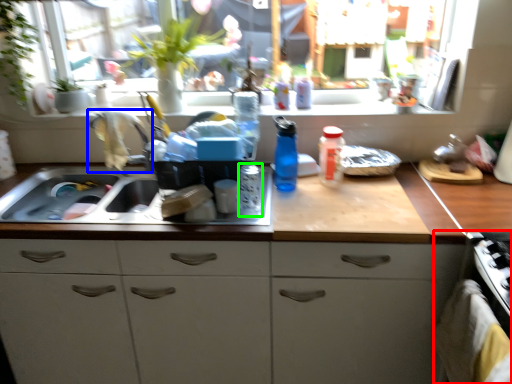
Question: Which object is the closest to the oven (highlighted by a red box)? Choose among these: faucet (highlighted by a blue box) or bottle (highlighted by a green box).

Choices:
 (A) faucet
 (B) bottle

Answer: (B)